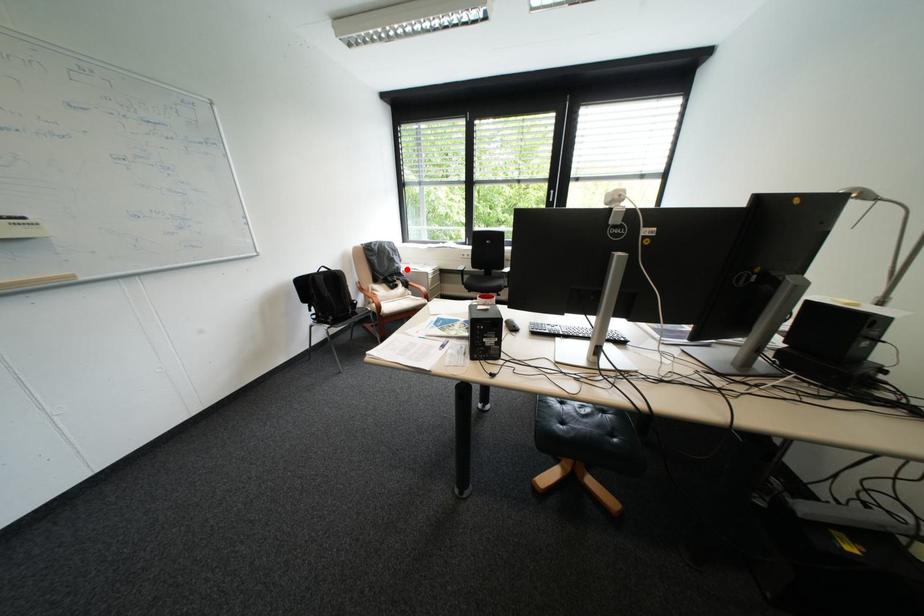
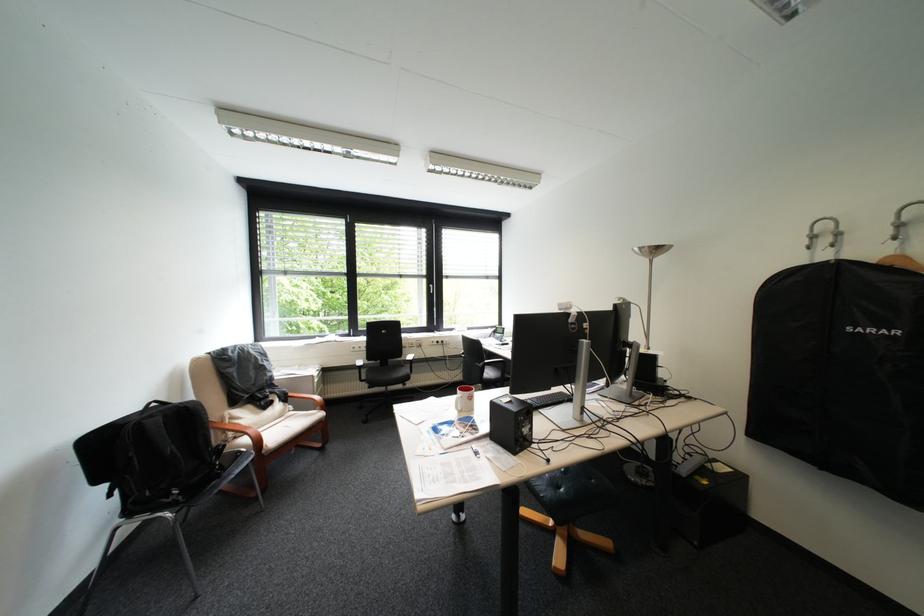
Question: I am providing you with two images of the same scene from different viewpoints. A red point is shown in image1. For the corresponding object point in image2, is it positioned nearer or farther from the camera?

Choices:
 (A) Nearer
 (B) Farther

Answer: (B)